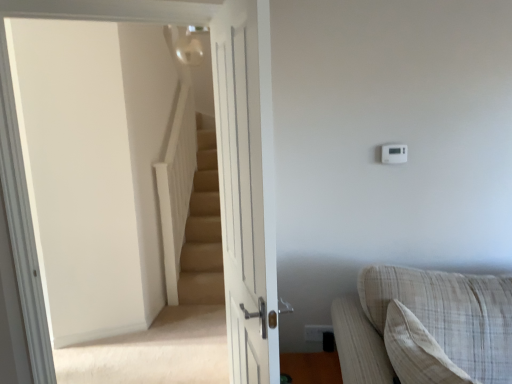
Question: Is white plastic electric outlet at upper right in front of or behind beige carpeted stairs at upper left in the image?

Choices:
 (A) front
 (B) behind

Answer: (B)

Question: From a real-world perspective, is white plastic electric outlet at upper right positioned above or below beige carpeted stairs at upper left?

Choices:
 (A) below
 (B) above

Answer: (A)

Question: Which object is positioned closest to the white wooden door at center?

Choices:
 (A) white plastic thermostat at upper right
 (B) beige carpeted stairs at upper left
 (C) beige fabric couch at lower right
 (D) white plastic electric outlet at upper right

Answer: (C)

Question: Which of these objects is positioned closest to the white plastic electric outlet at upper right?

Choices:
 (A) white wooden door at center
 (B) white plastic thermostat at upper right
 (C) beige carpeted stairs at upper left
 (D) beige fabric couch at lower right

Answer: (D)